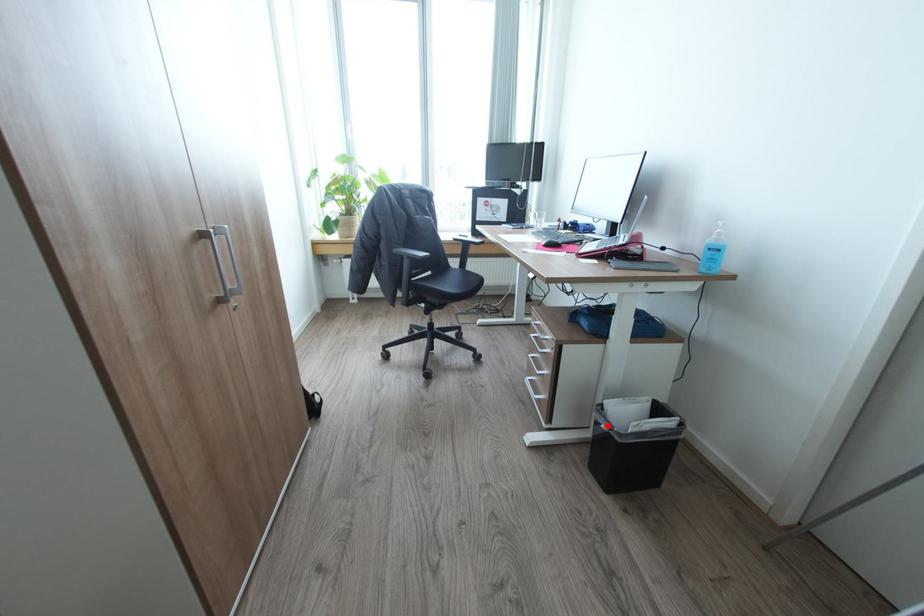
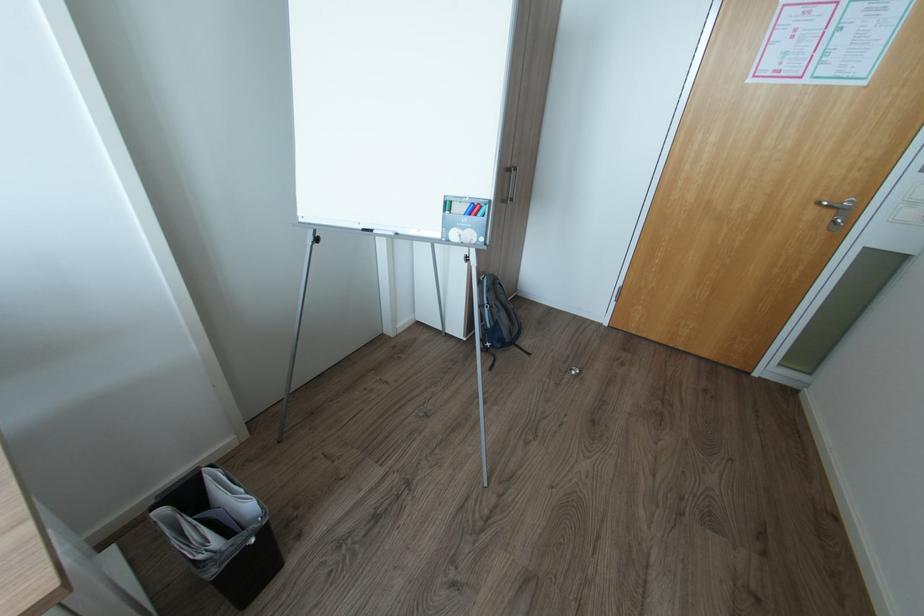
The point at the highlighted location is marked in the first image. Where is the corresponding point in the second image?

(257, 541)